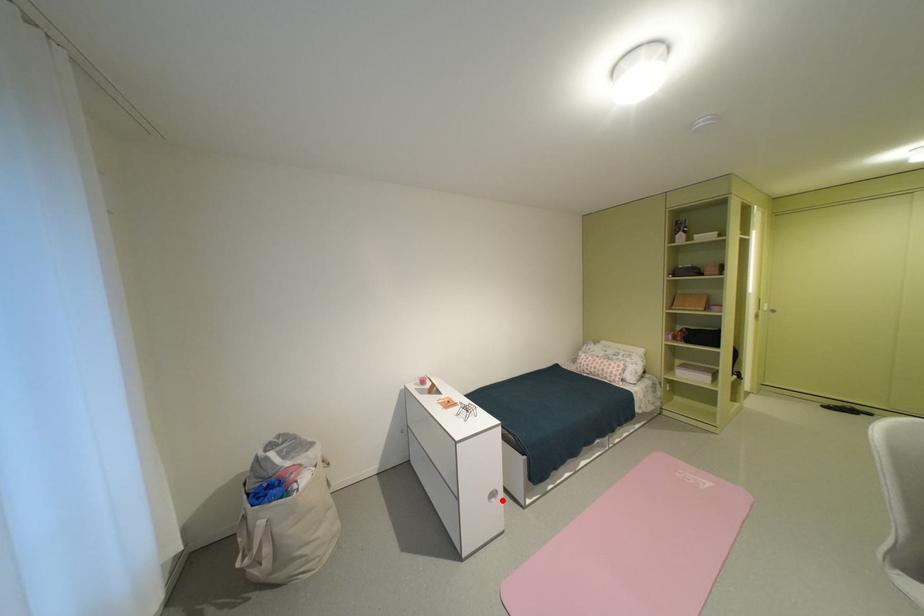
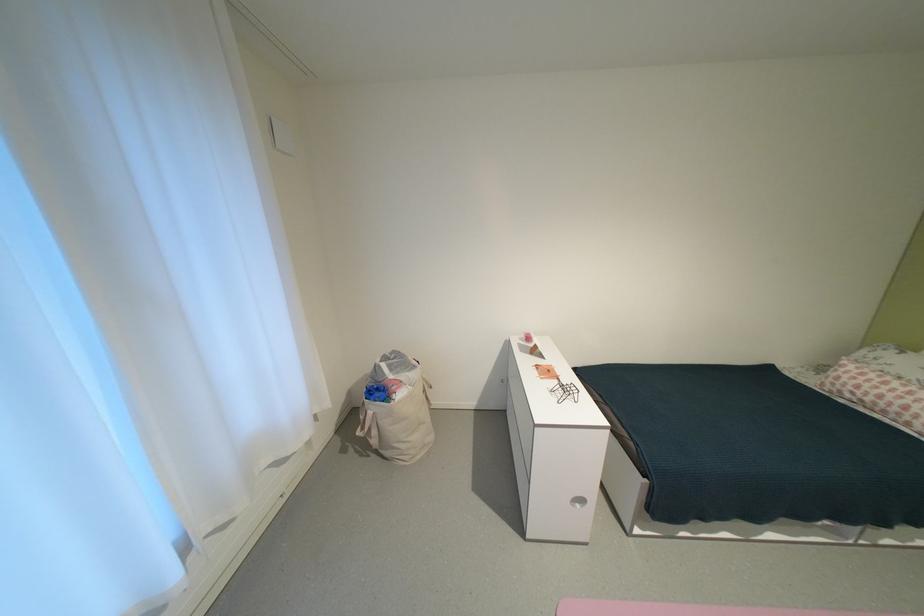
Find the pixel in the second image that matches the highlighted location in the first image.

(588, 506)